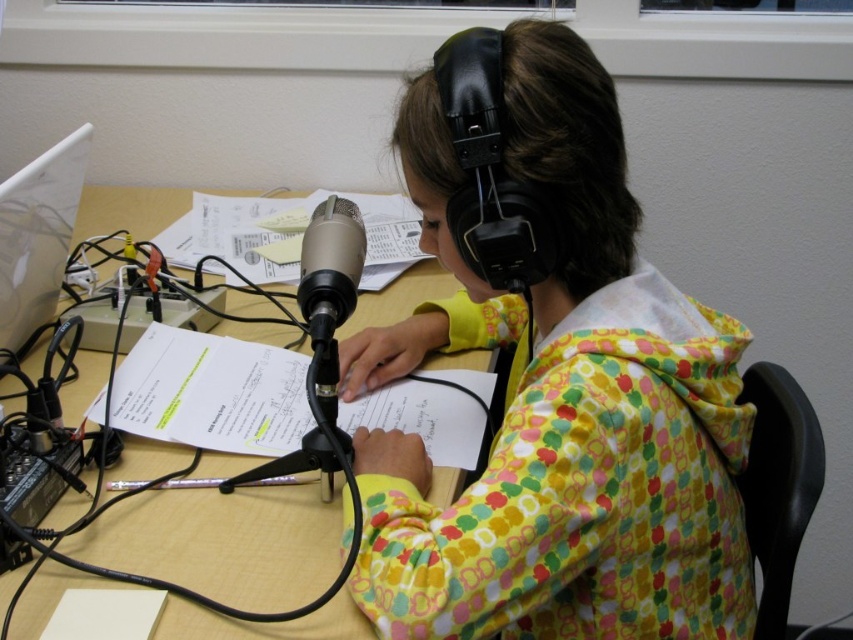
Question: Among these objects, which one is farthest from the camera?

Choices:
 (A) wooden table at center
 (B) white paper at center

Answer: (B)

Question: Which of these objects is positioned farthest from the white plastic laptop at left?

Choices:
 (A) yellow paper at center
 (B) yellow floral hoodie at center

Answer: (B)

Question: Is white paper at center positioned in front of black matte microphone at center?

Choices:
 (A) no
 (B) yes

Answer: (A)

Question: Is wooden table at center to the left of white paper at center from the viewer's perspective?

Choices:
 (A) no
 (B) yes

Answer: (A)

Question: Considering the relative positions of yellow paper at center and black matte microphone at center in the image provided, where is yellow paper at center located with respect to black matte microphone at center?

Choices:
 (A) left
 (B) right

Answer: (A)

Question: Which object appears closest to the camera in this image?

Choices:
 (A) yellow paper at center
 (B) white paper at center
 (C) black matte microphone at center

Answer: (C)